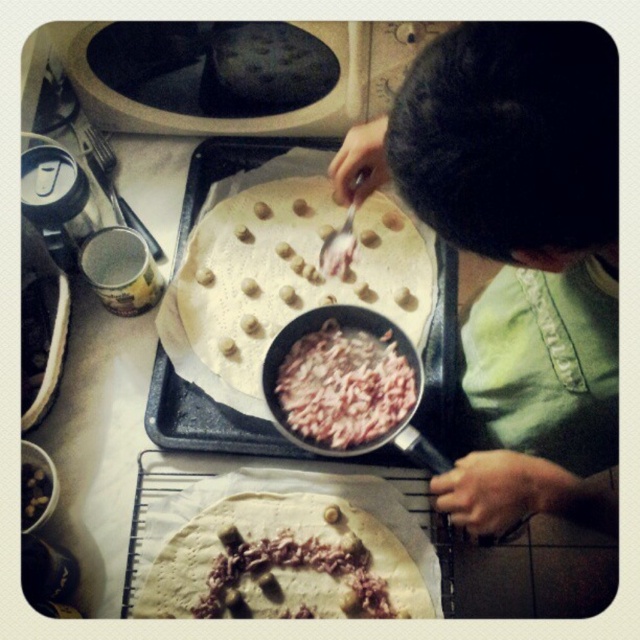
Does shiny pink shredded meat at center appear on the right side of shiny pink meat at center?

No, shiny pink shredded meat at center is not to the right of shiny pink meat at center.

Does shiny pink shredded meat at center have a lesser width compared to shiny pink meat at center?

In fact, shiny pink shredded meat at center might be wider than shiny pink meat at center.

What do you see at coordinates (284, 563) in the screenshot? The image size is (640, 640). I see `shiny pink shredded meat at center` at bounding box center [284, 563].

The image size is (640, 640). In order to click on shiny pink shredded meat at center in this screenshot , I will do `click(284, 563)`.

From the picture: Between white matte dough at center and shiny pink shredded meat at center, which one appears on the left side from the viewer's perspective?

shiny pink shredded meat at center

Between white matte dough at center and shiny pink shredded meat at center, which one has more height?

With more height is white matte dough at center.

Does point (221, 355) come closer to viewer compared to point (209, 604)?

No, it is not.

Image resolution: width=640 pixels, height=640 pixels. What are the coordinates of `white matte dough at center` in the screenshot? It's located at (291, 273).

Can you confirm if green fabric shirt at center is positioned to the right of shiny pink meat at center?

Indeed, green fabric shirt at center is positioned on the right side of shiny pink meat at center.

Which is more to the left, green fabric shirt at center or shiny pink meat at center?

shiny pink meat at center

Measure the distance between point (x=532, y=186) and camera.

They are 17.95 inches apart.

Identify the location of green fabric shirt at center. The width and height of the screenshot is (640, 640). (516, 243).